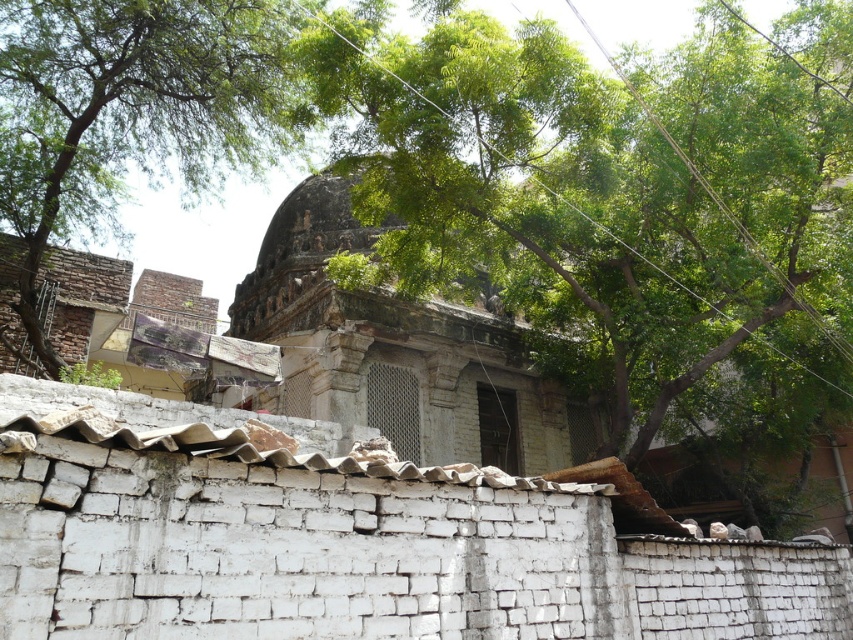
Is green leafy tree at upper center shorter than green leafy tree at upper left?

In fact, green leafy tree at upper center may be taller than green leafy tree at upper left.

Who is lower down, green leafy tree at upper center or green leafy tree at upper left?

green leafy tree at upper center

Image resolution: width=853 pixels, height=640 pixels. In order to click on green leafy tree at upper center in this screenshot , I will do `click(584, 193)`.